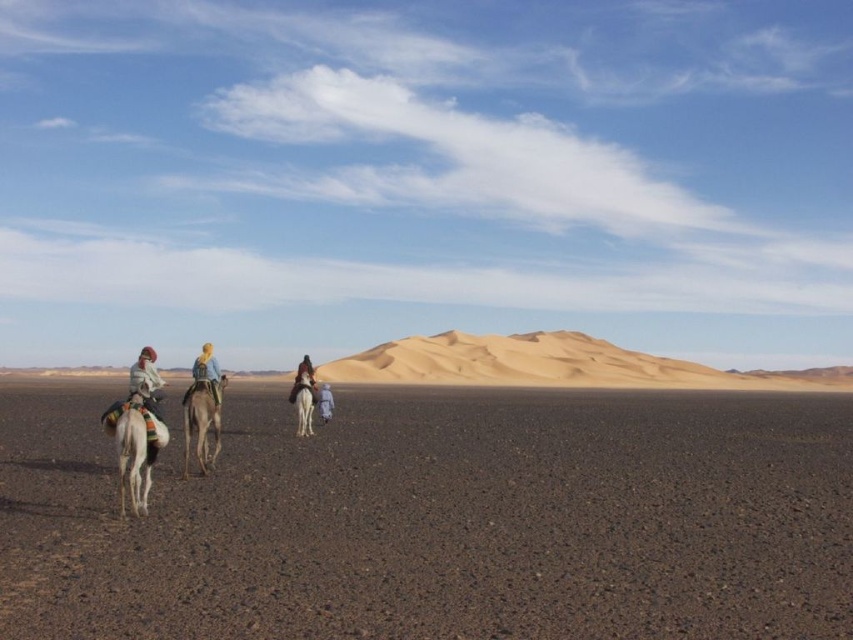
You are navigating a drone that needs to land on the brown sandy dirt at lower center. According to the coordinates provided, where exactly should the drone aim to land?

The brown sandy dirt at lower center is located at point (438, 518), so the drone should aim for those coordinates to land safely.

You are planning to take a photo of the white matte camel at center and the dark brown leather saddle at center. Based on their sizes in the image, which object should you focus on first if you want both to be in sharp focus?

The white matte camel at center occupies less space than the dark brown leather saddle at center, so you should focus on the dark brown leather saddle at center first since it is larger and will require more precise focusing to ensure sharpness throughout.

You are standing in the desert scene described. You want to walk from your current position to the white matte camel at center. Which direction should you move relative to the brown sandy dirt at lower center?

You should move forward towards the white matte camel at center, as the brown sandy dirt at lower center is in front of it, meaning the camel is behind the dirt from your perspective.